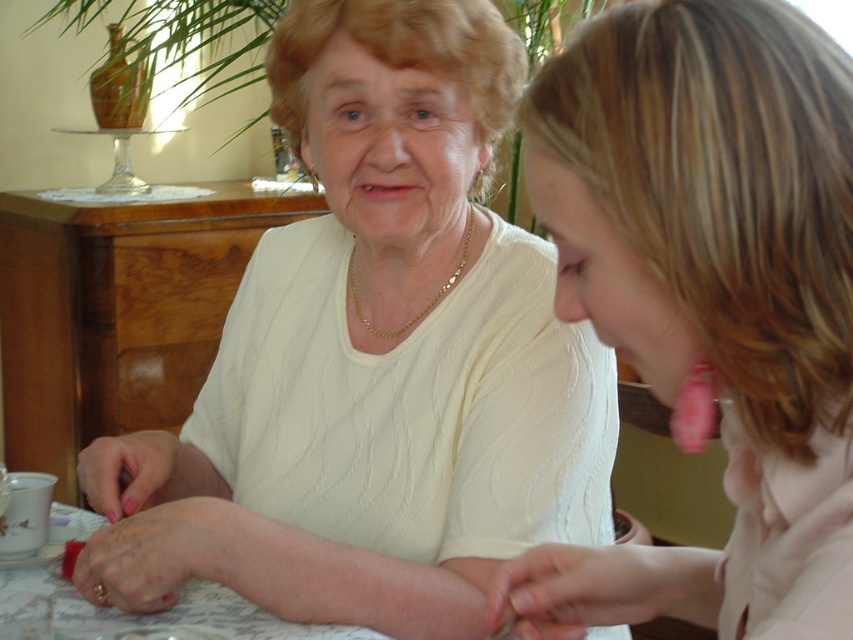
What are the coordinates of the white knit sweater at center?

The white knit sweater at center is located at coordinates (x=373, y=358).

You are a photographer setting up a shoot in this scene. You need to place a small lamp between the white knit sweater at center and the white fabric table at lower left. According to the scene description, which object should the lamp be closer to?

The white knit sweater at center is positioned on the right side of white fabric table at lower left, so the lamp should be placed closer to the white fabric table at lower left.

You are an interior designer assessing the placement of objects in a living room. You notice the pink fabric ear at upper right and the white fabric table at lower left. Which object is positioned higher in the image?

The pink fabric ear at upper right is positioned higher in the image than the white fabric table at lower left.